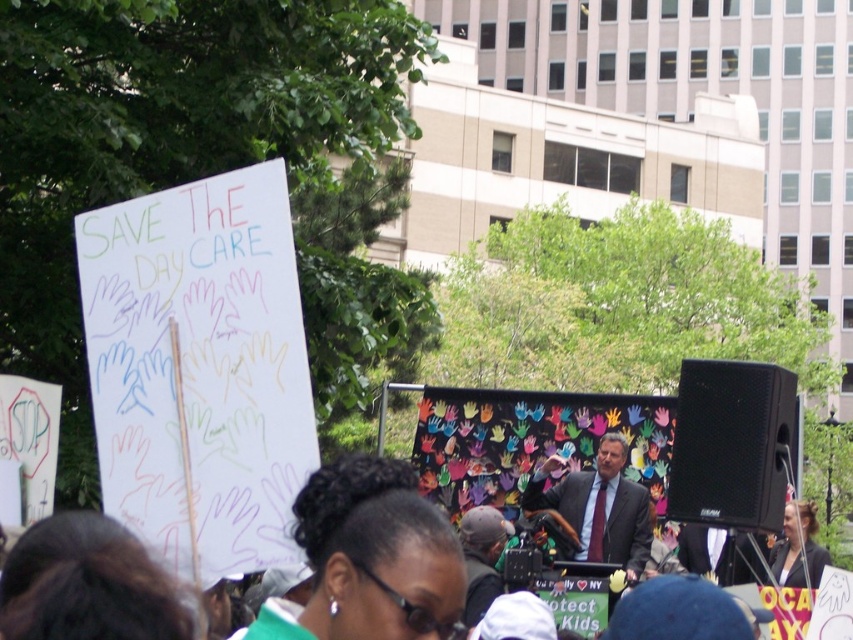
Does point (703, 406) lie in front of point (573, 515)?

Yes, it is in front of point (573, 515).

Does black plastic speaker at center-right have a larger size compared to matte black suit at center?

Yes.

At what (x,y) coordinates should I click in order to perform the action: click on black plastic speaker at center-right. Please return your answer as a coordinate pair (x, y). The image size is (853, 640). Looking at the image, I should click on (730, 444).